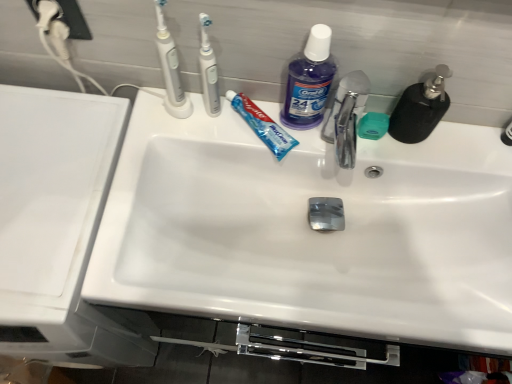
Question: Is white glossy sink at left outside white glossy sink at center?

Choices:
 (A) no
 (B) yes

Answer: (B)

Question: Is white glossy sink at left behind white glossy sink at center?

Choices:
 (A) no
 (B) yes

Answer: (A)

Question: Is white glossy sink at left aimed at white glossy sink at center?

Choices:
 (A) no
 (B) yes

Answer: (A)

Question: Does white glossy sink at left appear on the left side of white glossy sink at center?

Choices:
 (A) no
 (B) yes

Answer: (B)

Question: Is white glossy sink at left taller than white glossy sink at center?

Choices:
 (A) no
 (B) yes

Answer: (B)

Question: Considering the positions of chrome metallic faucet at center and white glossy sink at center in the image, is chrome metallic faucet at center wider or thinner than white glossy sink at center?

Choices:
 (A) wide
 (B) thin

Answer: (B)

Question: In terms of height, does chrome metallic faucet at center look taller or shorter compared to white glossy sink at center?

Choices:
 (A) short
 (B) tall

Answer: (A)

Question: From the image's perspective, is chrome metallic faucet at center located above or below white glossy sink at center?

Choices:
 (A) below
 (B) above

Answer: (B)

Question: Considering their positions, is chrome metallic faucet at center located in front of or behind white glossy sink at center?

Choices:
 (A) behind
 (B) front

Answer: (B)

Question: Is green matte soap at center spatially inside purple translucent liquid at upper center, or outside of it?

Choices:
 (A) inside
 (B) outside

Answer: (B)

Question: From a real-world perspective, is green matte soap at center positioned above or below purple translucent liquid at upper center?

Choices:
 (A) above
 (B) below

Answer: (B)

Question: Is point (371, 130) positioned closer to the camera than point (310, 125)?

Choices:
 (A) closer
 (B) farther

Answer: (A)

Question: In terms of width, does green matte soap at center look wider or thinner when compared to purple translucent liquid at upper center?

Choices:
 (A) thin
 (B) wide

Answer: (A)

Question: In the image, is white plastic toothbrush at upper left, placed as the 1th toothbrush when sorted from left to right, positioned in front of or behind white glossy sink at center?

Choices:
 (A) front
 (B) behind

Answer: (A)

Question: Which is correct: white plastic toothbrush at upper left, placed as the 1th toothbrush when sorted from left to right, is inside white glossy sink at center, or outside of it?

Choices:
 (A) outside
 (B) inside

Answer: (A)